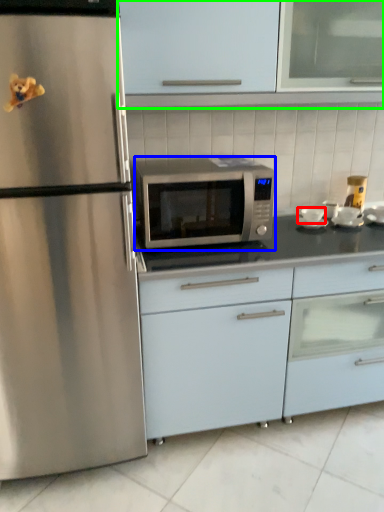
Question: Based on their relative distances, which object is farther from appliance (highlighted by a red box)? Choose from microwave oven (highlighted by a blue box) and cabinetry (highlighted by a green box).

Choices:
 (A) microwave oven
 (B) cabinetry

Answer: (B)